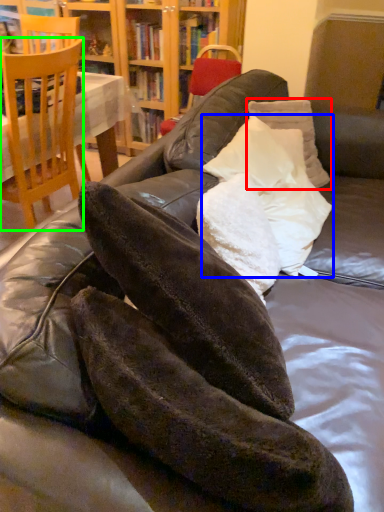
Question: Estimate the real-world distances between objects in this image. Which object is farther from pillow (highlighted by a red box), pillow (highlighted by a blue box) or chair (highlighted by a green box)?

Choices:
 (A) pillow
 (B) chair

Answer: (B)